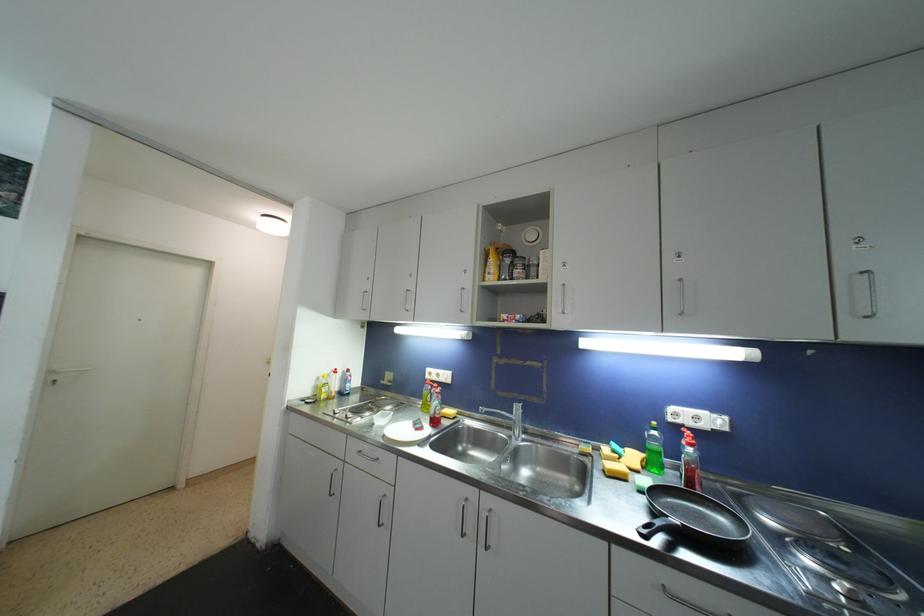
Where is `stovetop knob`? The height and width of the screenshot is (616, 924). stovetop knob is located at coordinates (845, 590).